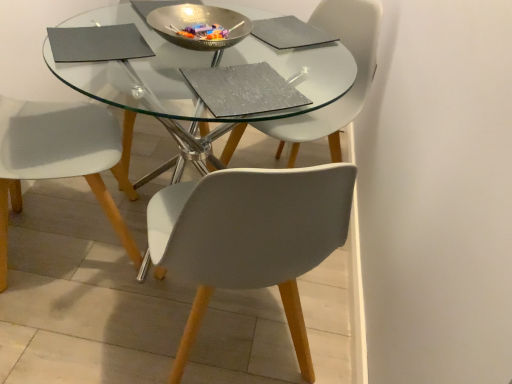
Question: From the image's perspective, is matte gray chair at center, the first chair in the right-to-left sequence, positioned above or below metallic silver bowl at center?

Choices:
 (A) above
 (B) below

Answer: (B)

Question: Is matte gray chair at center, acting as the second chair starting from the left, in front of or behind metallic silver bowl at center in the image?

Choices:
 (A) front
 (B) behind

Answer: (B)

Question: Which of these objects is positioned closest to the metallic silver bowl at center?

Choices:
 (A) white matte chair at lower left, which is the second chair in right-to-left order
 (B) matte gray chair at center, acting as the second chair starting from the left

Answer: (B)

Question: Which is nearer to the matte gray chair at center, acting as the second chair starting from the left?

Choices:
 (A) white matte chair at lower left, which is the second chair in right-to-left order
 (B) metallic silver bowl at center

Answer: (B)